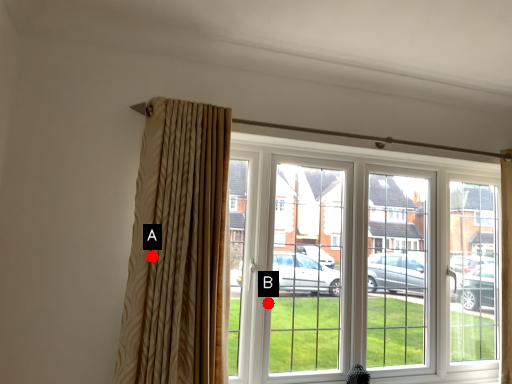
Question: Two points are circled on the image, labeled by A and B beside each circle. Which of the following is the farthest from the observer?

Choices:
 (A) A is further
 (B) B is further

Answer: (B)